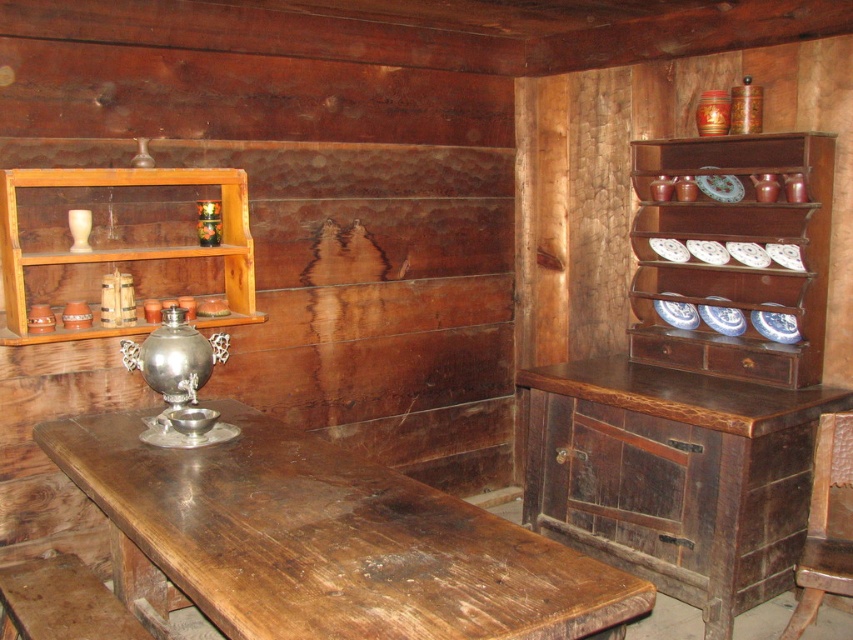
You are standing in the rustic cabin kitchen and want to take a photo of the dark brown wooden cabinet at right. Your camera has a maximum focus range of 2.5 meters. Will you be able to focus on the cabinet from your current position?

The dark brown wooden cabinet at right and camera are 2.45 meters apart, so yes, the camera can focus on the dark brown wooden cabinet at right since the distance is within its maximum range of 2.5 meters.

You are organizing a shelf in the rustic cabin kitchen. You need to place a tall decorative vase that requires a stable base. Which object, the dark brown wooden cabinet at right or the brown wooden shelf at upper right, is more suitable for placing the vase?

The dark brown wooden cabinet at right is positioned under the brown wooden shelf at upper right, making it a more stable base for the tall decorative vase since it is lower and provides a firmer foundation.